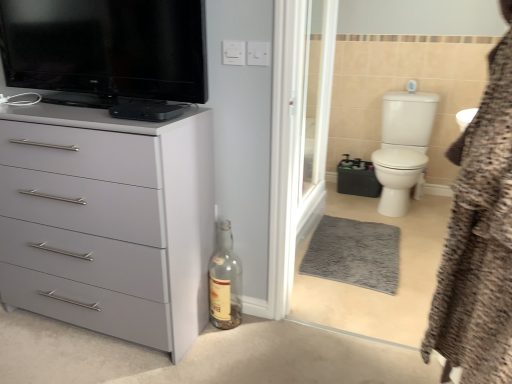
Question: Is white glossy toilet bowl at right positioned behind black glossy television at upper left?

Choices:
 (A) no
 (B) yes

Answer: (B)

Question: From the image's perspective, is white glossy toilet bowl at right on black glossy television at upper left?

Choices:
 (A) no
 (B) yes

Answer: (A)

Question: Is white glossy toilet bowl at right closer to camera compared to black glossy television at upper left?

Choices:
 (A) no
 (B) yes

Answer: (A)

Question: Can you confirm if white glossy toilet bowl at right is positioned to the left of black glossy television at upper left?

Choices:
 (A) no
 (B) yes

Answer: (A)

Question: From the image's perspective, would you say white glossy toilet bowl at right is shown under black glossy television at upper left?

Choices:
 (A) yes
 (B) no

Answer: (A)

Question: Which is correct: white glossy toilet bowl at right is inside brown textured bathrobe at right, or outside of it?

Choices:
 (A) outside
 (B) inside

Answer: (A)

Question: In terms of height, does white glossy toilet bowl at right look taller or shorter compared to brown textured bathrobe at right?

Choices:
 (A) tall
 (B) short

Answer: (B)

Question: Is white glossy toilet bowl at right bigger or smaller than brown textured bathrobe at right?

Choices:
 (A) small
 (B) big

Answer: (B)

Question: Is point (388, 206) positioned closer to the camera than point (438, 329)?

Choices:
 (A) closer
 (B) farther

Answer: (B)

Question: Would you say matte gray chest of drawers at left is to the left or to the right of white glossy toilet bowl at right in the picture?

Choices:
 (A) right
 (B) left

Answer: (B)

Question: Considering the positions of matte gray chest of drawers at left and white glossy toilet bowl at right in the image, is matte gray chest of drawers at left taller or shorter than white glossy toilet bowl at right?

Choices:
 (A) tall
 (B) short

Answer: (A)

Question: From the image's perspective, is matte gray chest of drawers at left located above or below white glossy toilet bowl at right?

Choices:
 (A) above
 (B) below

Answer: (B)

Question: From a real-world perspective, relative to white glossy toilet bowl at right, is matte gray chest of drawers at left vertically above or below?

Choices:
 (A) above
 (B) below

Answer: (A)

Question: From the image's perspective, relative to brown textured bathrobe at right, is transparent glass screen door at center above or below?

Choices:
 (A) below
 (B) above

Answer: (B)

Question: Is transparent glass screen door at center in front of or behind brown textured bathrobe at right in the image?

Choices:
 (A) behind
 (B) front

Answer: (A)